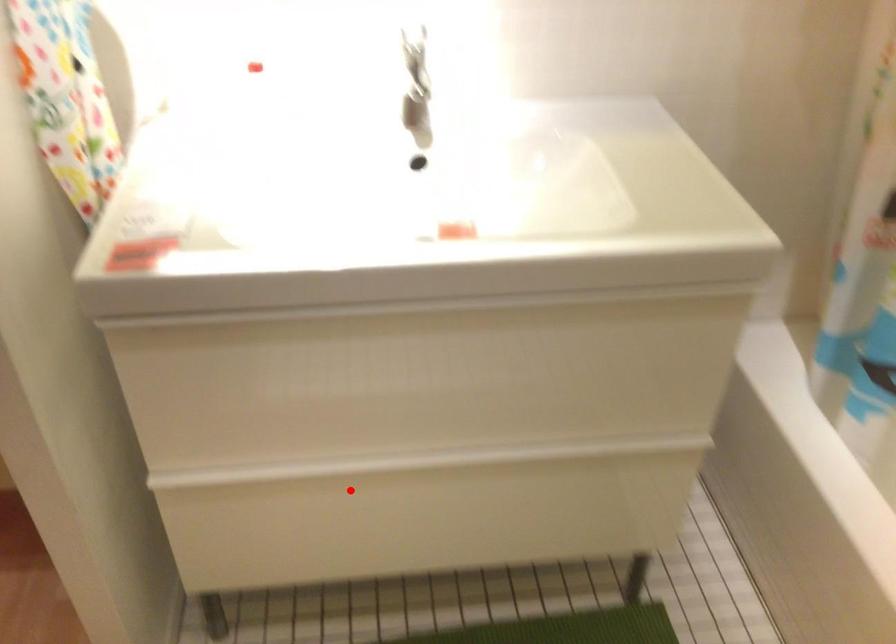
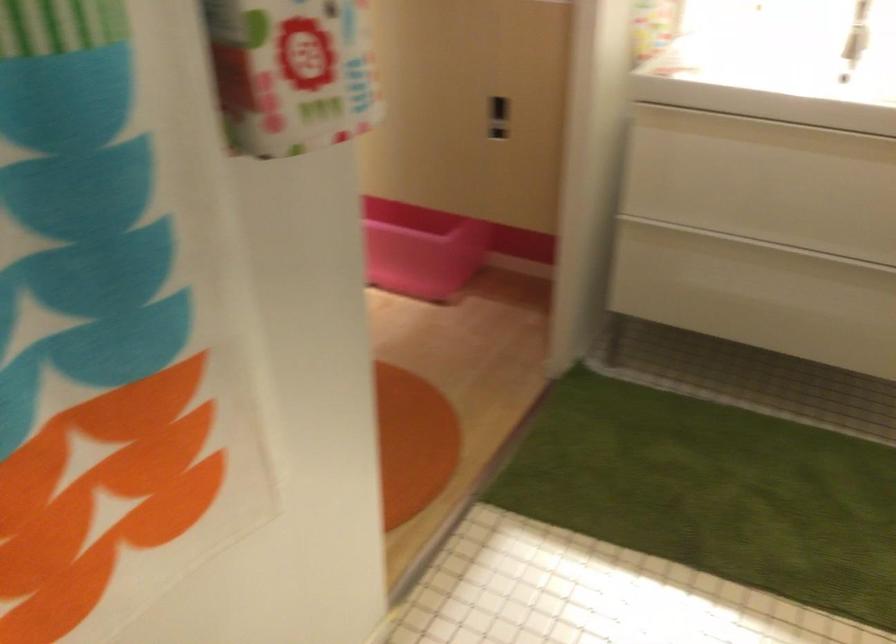
The point at the highlighted location is marked in the first image. Where is the corresponding point in the second image?

(734, 254)